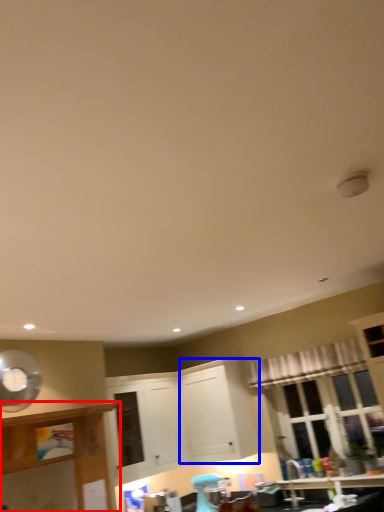
Question: Which object is further to the camera taking this photo, cabinetry (highlighted by a red box) or cabinetry (highlighted by a blue box)?

Choices:
 (A) cabinetry
 (B) cabinetry

Answer: (B)